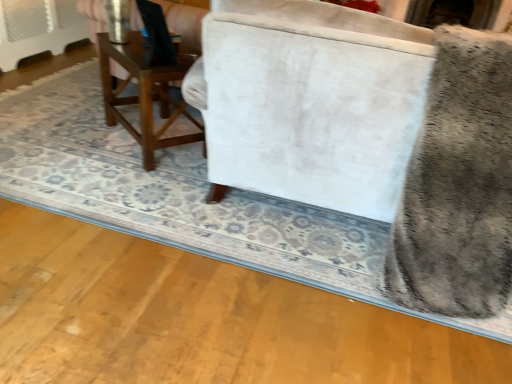
This screenshot has width=512, height=384. Find the location of `wooden table at center`. wooden table at center is located at coordinates 144,94.

This screenshot has height=384, width=512. What do you see at coordinates (144, 94) in the screenshot?
I see `wooden table at center` at bounding box center [144, 94].

The height and width of the screenshot is (384, 512). Describe the element at coordinates (458, 185) in the screenshot. I see `gray plush swivel chair at right` at that location.

Identify the location of gray plush swivel chair at right. The image size is (512, 384). (458, 185).

Identify the location of wooden table at center. (144, 94).

Does gray plush swivel chair at right appear on the left side of wooden table at center?

Incorrect, gray plush swivel chair at right is not on the left side of wooden table at center.

Which is in front, gray plush swivel chair at right or wooden table at center?

gray plush swivel chair at right is in front.

Does point (435, 264) lie behind point (155, 136)?

No, (435, 264) is in front of (155, 136).

From the image's perspective, would you say gray plush swivel chair at right is shown under wooden table at center?

Yes, from the image's perspective, gray plush swivel chair at right is below wooden table at center.

From a real-world perspective, is gray plush swivel chair at right beneath wooden table at center?

No.

Which object is thinner, gray plush swivel chair at right or wooden table at center?

wooden table at center is thinner.

Consider the image. Is gray plush swivel chair at right taller or shorter than wooden table at center?

Clearly, gray plush swivel chair at right is taller compared to wooden table at center.

Who is smaller, gray plush swivel chair at right or wooden table at center?

Smaller between the two is wooden table at center.

Is gray plush swivel chair at right surrounding wooden table at center?

No.

Is there a large distance between gray plush swivel chair at right and wooden table at center?

That's right, there is a large distance between gray plush swivel chair at right and wooden table at center.

Is gray plush swivel chair at right positioned with its back to wooden table at center?

No, wooden table at center is not at the back of gray plush swivel chair at right.

How many degrees apart are the facing directions of gray plush swivel chair at right and wooden table at center?

39.8 degrees separate the facing orientations of gray plush swivel chair at right and wooden table at center.

Where is `table that appears behind the gray plush swivel chair at right`? Image resolution: width=512 pixels, height=384 pixels. table that appears behind the gray plush swivel chair at right is located at coordinates (144, 94).

Considering the relative positions of wooden table at center and gray plush swivel chair at right in the image provided, is wooden table at center to the left or to the right of gray plush swivel chair at right?

Based on their positions, wooden table at center is located to the left of gray plush swivel chair at right.

Does wooden table at center lie in front of gray plush swivel chair at right?

No.

Is point (116, 122) more distant than point (389, 275)?

Yes, it is.

From the image's perspective, which one is positioned higher, wooden table at center or gray plush swivel chair at right?

wooden table at center is shown above in the image.

Looking at this image, from a real-world perspective, is wooden table at center on gray plush swivel chair at right?

No, from a real-world perspective, wooden table at center is not above gray plush swivel chair at right.

Considering the relative sizes of wooden table at center and gray plush swivel chair at right in the image provided, is wooden table at center thinner than gray plush swivel chair at right?

Indeed, wooden table at center has a lesser width compared to gray plush swivel chair at right.

Which of these two, wooden table at center or gray plush swivel chair at right, stands taller?

With more height is gray plush swivel chair at right.

Can you confirm if wooden table at center is smaller than gray plush swivel chair at right?

Correct, wooden table at center occupies less space than gray plush swivel chair at right.

Is wooden table at center outside of gray plush swivel chair at right?

Yes, wooden table at center is located beyond the bounds of gray plush swivel chair at right.

Consider the image. Would you say wooden table at center is a long distance from gray plush swivel chair at right?

Yes, wooden table at center and gray plush swivel chair at right are located far from each other.

Does wooden table at center turn towards gray plush swivel chair at right?

No.

Where is `table below the gray plush swivel chair at right (from a real-world perspective)`? Image resolution: width=512 pixels, height=384 pixels. table below the gray plush swivel chair at right (from a real-world perspective) is located at coordinates (144, 94).

Identify the location of table above the gray plush swivel chair at right (from the image's perspective). (144, 94).

The height and width of the screenshot is (384, 512). In order to click on table that is behind the gray plush swivel chair at right in this screenshot , I will do `click(144, 94)`.